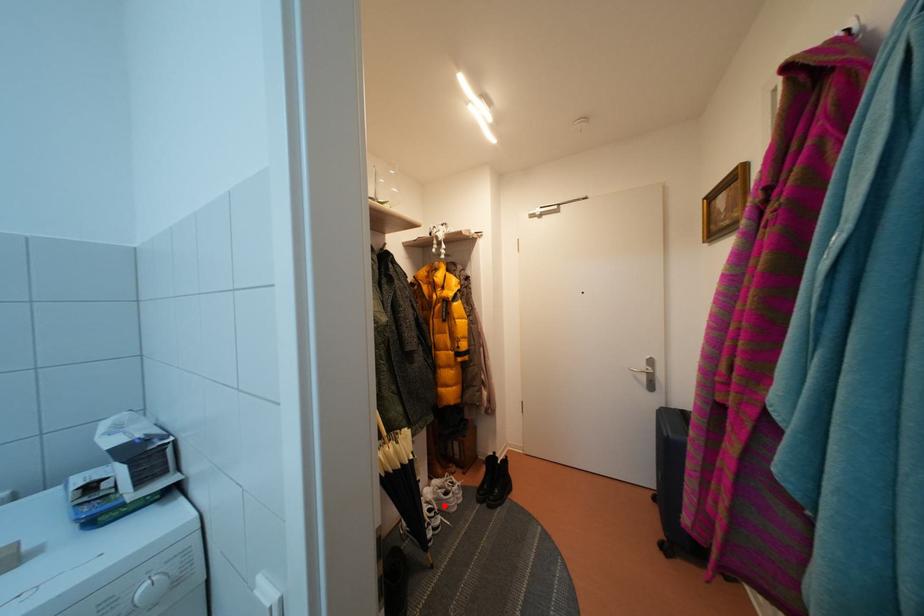
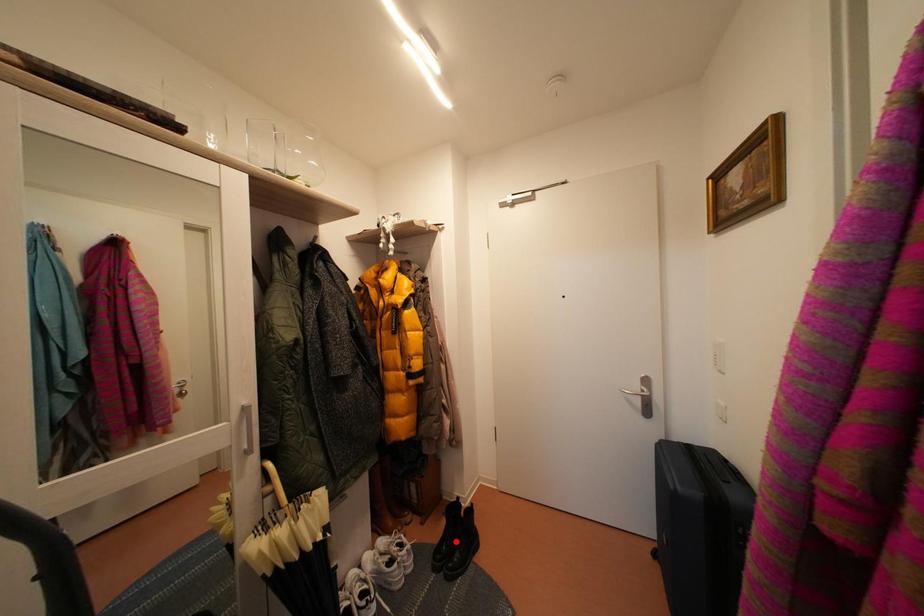
I am providing you with two images of the same scene from different viewpoints. A red point is marked on the first image and another point is marked on the second image. Do the highlighted points in image1 and image2 indicate the same real-world spot?

No